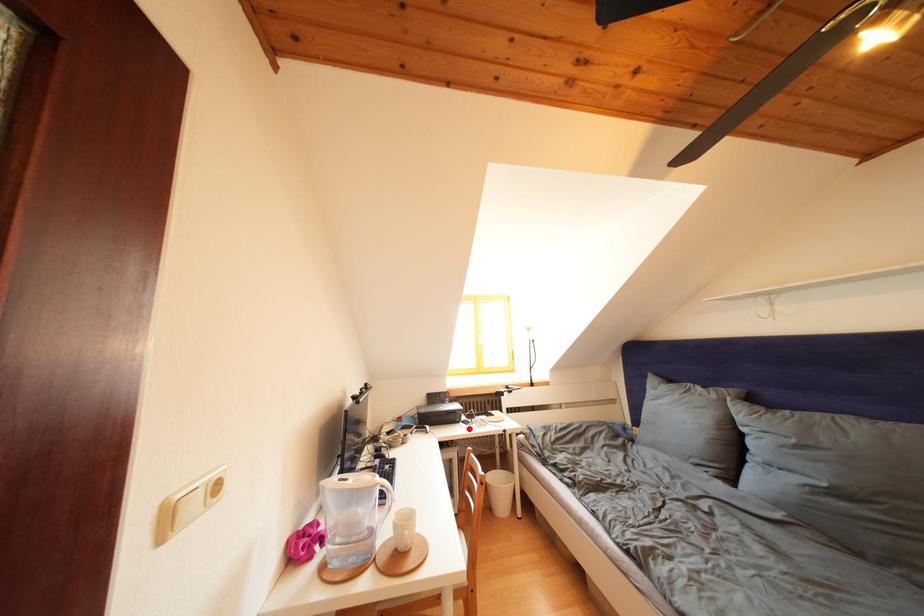
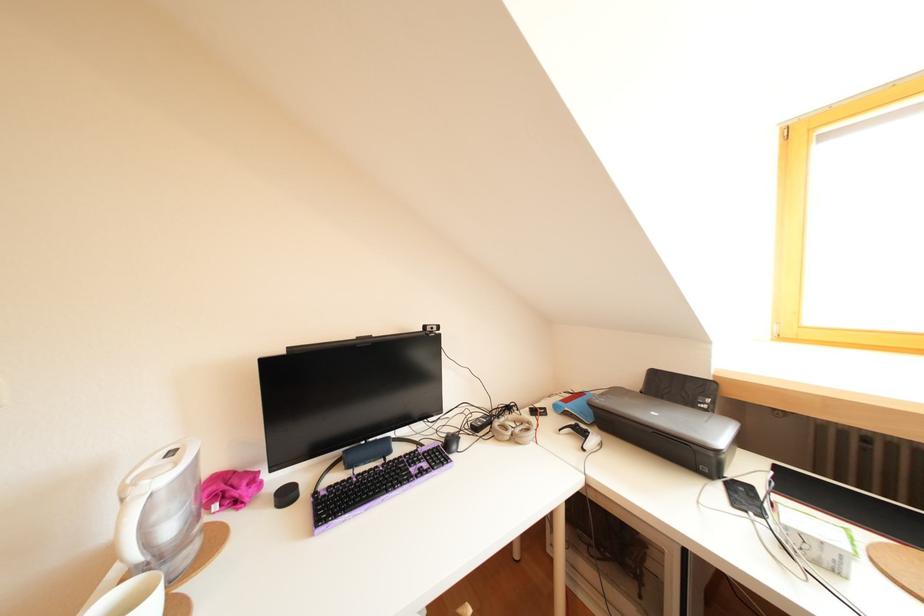
Find the pixel in the second image that matches the highlighted location in the first image.

(727, 490)